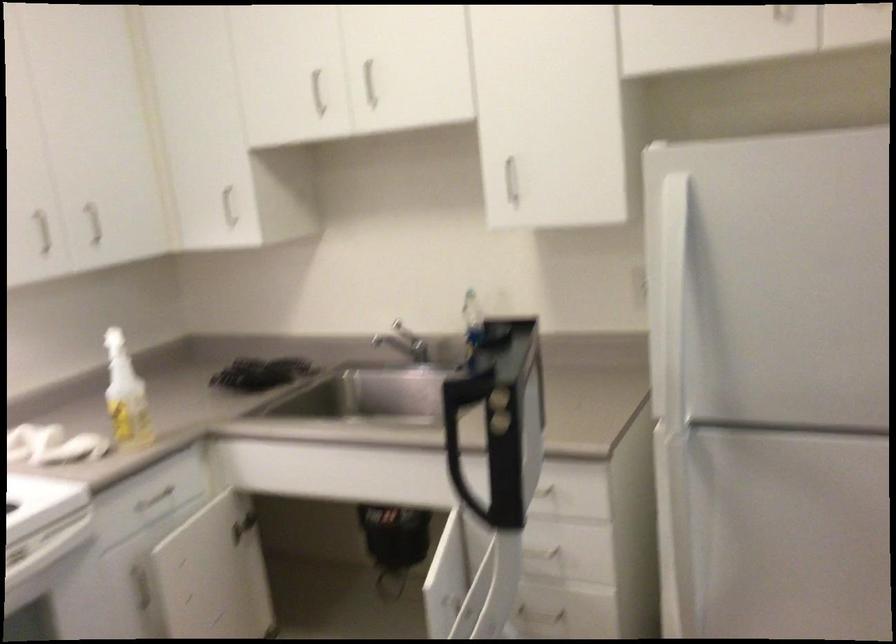
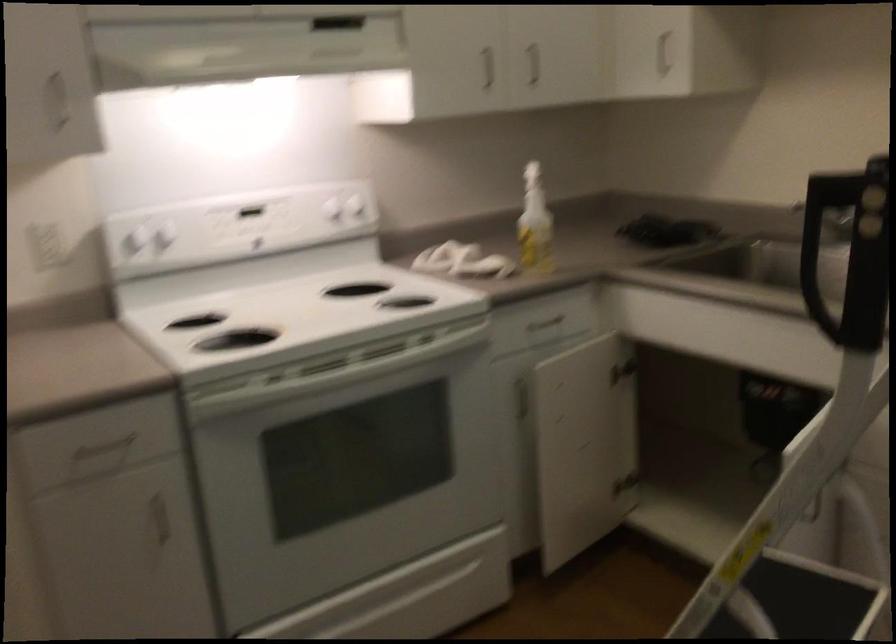
The point at (229, 213) is marked in the first image. Where is the corresponding point in the second image?

(661, 53)